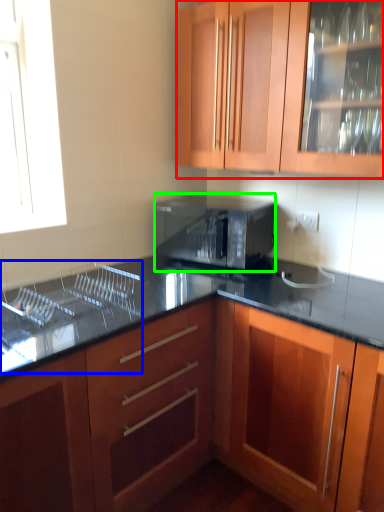
Question: Which is nearer to the cabinetry (highlighted by a red box)? sink (highlighted by a blue box) or microwave oven (highlighted by a green box).

Choices:
 (A) sink
 (B) microwave oven

Answer: (B)